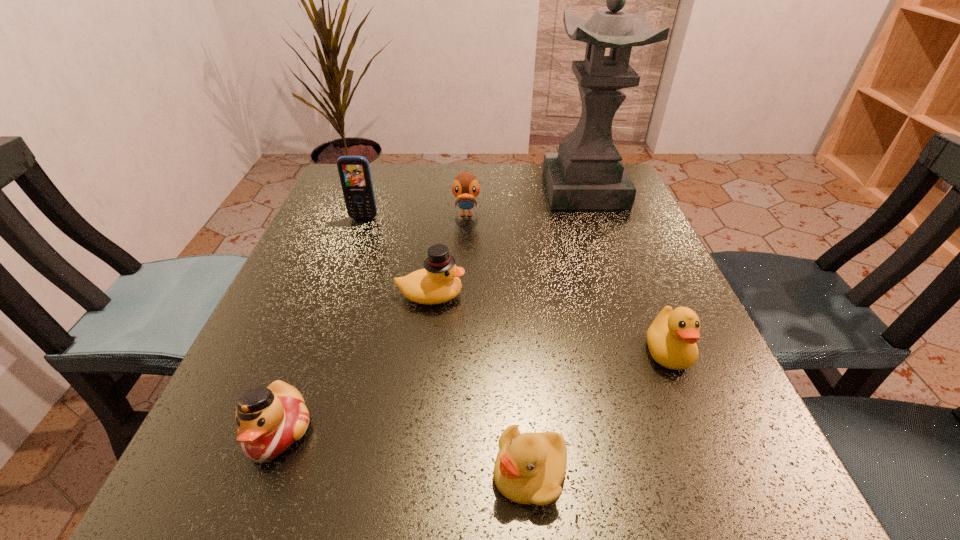
Where is `duckling that is positioned at the near edge`? duckling that is positioned at the near edge is located at coordinates (529, 469).

Where is `cellular telephone positioned at the left edge`? This screenshot has width=960, height=540. cellular telephone positioned at the left edge is located at coordinates (354, 171).

I want to click on duck positioned at the left edge, so click(x=270, y=420).

This screenshot has width=960, height=540. Identify the location of sculpture positioned at the right edge. (587, 172).

You are a GUI agent. You are given a task and a screenshot of the screen. Output one action in this format:
    pyautogui.click(x=<x>, y=<y>)
    Task: Click on the duck that is at the right edge
    Image resolution: width=960 pixels, height=540 pixels.
    Given the screenshot: What is the action you would take?
    671,338

You are a GUI agent. You are given a task and a screenshot of the screen. Output one action in this format:
    pyautogui.click(x=<x>, y=<y>)
    Task: Click on the object that is at the near left corner
    
    Given the screenshot: What is the action you would take?
    pyautogui.click(x=270, y=420)

The image size is (960, 540). What are the coordinates of `object that is at the far right corner` in the screenshot? It's located at (587, 172).

The width and height of the screenshot is (960, 540). What are the coordinates of `vacant space at the far edge` in the screenshot? It's located at (449, 166).

Find the location of a particular element. Image resolution: width=960 pixels, height=540 pixels. vacant area at the near edge is located at coordinates (349, 483).

This screenshot has height=540, width=960. In order to click on vacant space at the left edge of the desktop in this screenshot , I will do `click(293, 326)`.